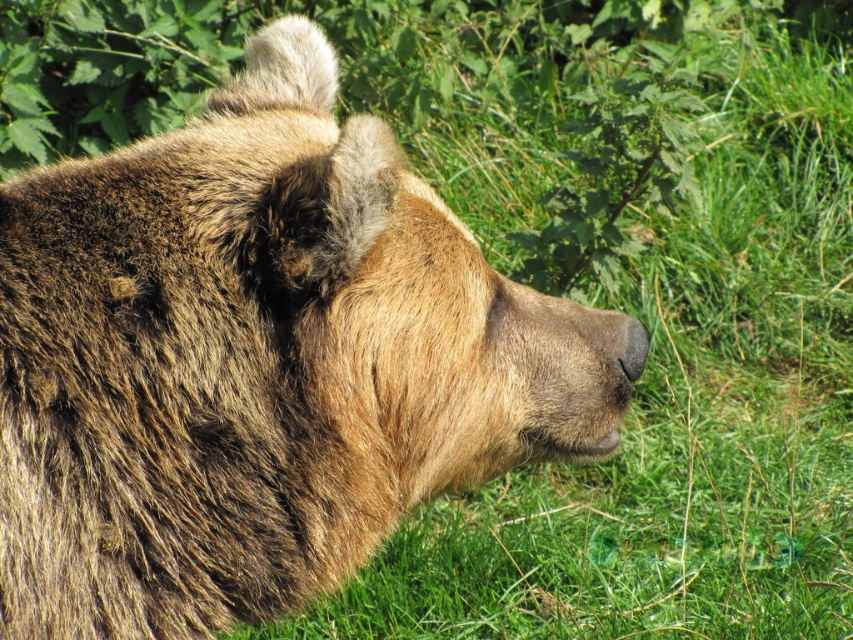
Question: Considering the relative positions of fuzzy brown bear at center and black fur nose at center in the image provided, where is fuzzy brown bear at center located with respect to black fur nose at center?

Choices:
 (A) left
 (B) right

Answer: (A)

Question: Can you confirm if green leafy plant at upper center is bigger than black fur nose at center?

Choices:
 (A) yes
 (B) no

Answer: (A)

Question: Which object appears farthest from the camera in this image?

Choices:
 (A) fuzzy brown bear at center
 (B) green leafy plant at upper center
 (C) black fur nose at center

Answer: (B)

Question: Which of the following is the closest to the observer?

Choices:
 (A) green leafy plant at upper center
 (B) fuzzy brown bear at center

Answer: (B)

Question: Does fuzzy brown bear at center appear under black fur nose at center?

Choices:
 (A) yes
 (B) no

Answer: (B)

Question: Which is nearer to the fuzzy brown bear at center?

Choices:
 (A) green leafy plant at upper center
 (B) black fur nose at center

Answer: (B)